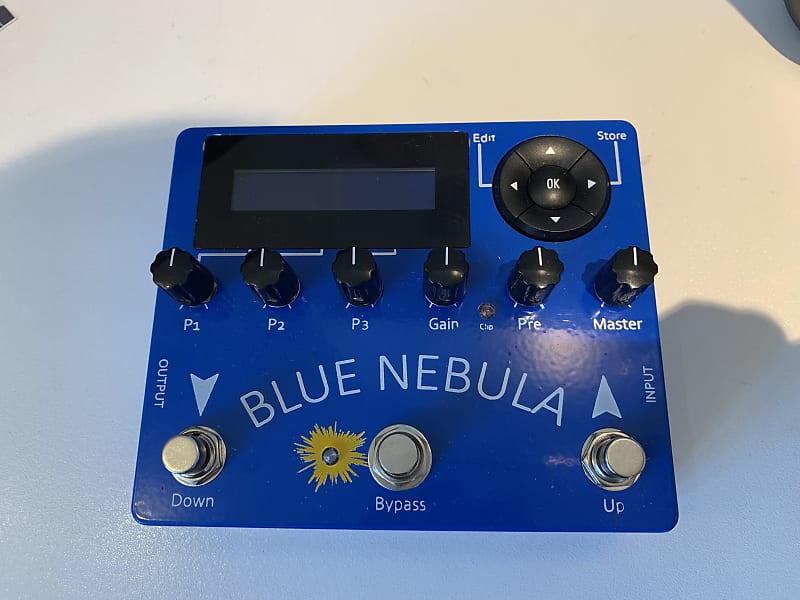
Identify the location of knob. (168, 264), (260, 254), (354, 263), (442, 264), (546, 262), (626, 269).